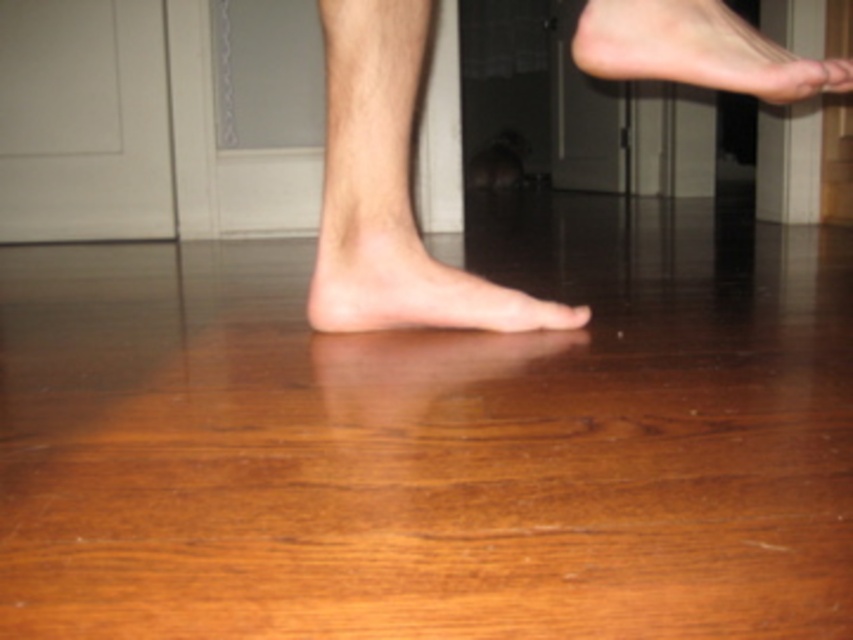
Question: In this image, where is skinny barefoot at center located relative to matte wood toe at center?

Choices:
 (A) right
 (B) left

Answer: (B)

Question: Is hairless skin at center below skinny barefoot at upper right?

Choices:
 (A) yes
 (B) no

Answer: (A)

Question: Among these objects, which one is nearest to the camera?

Choices:
 (A) skinny barefoot at center
 (B) matte wood toe at center
 (C) skinny barefoot at upper right
 (D) hairless skin at center

Answer: (C)

Question: Which object is farther from the camera taking this photo?

Choices:
 (A) hairless skin at center
 (B) matte wood toe at center
 (C) skinny barefoot at center
 (D) skinny barefoot at upper right

Answer: (B)

Question: Which object is the closest to the skinny barefoot at center?

Choices:
 (A) matte wood toe at center
 (B) hairless skin at center

Answer: (B)

Question: Does hairless skin at center have a greater width compared to skinny barefoot at center?

Choices:
 (A) yes
 (B) no

Answer: (B)